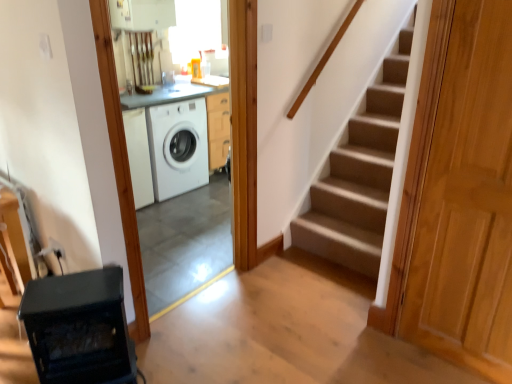
Where is `free space between light brown wooden door at right and white glossy washing machine at center`? This screenshot has width=512, height=384. free space between light brown wooden door at right and white glossy washing machine at center is located at coordinates [293, 334].